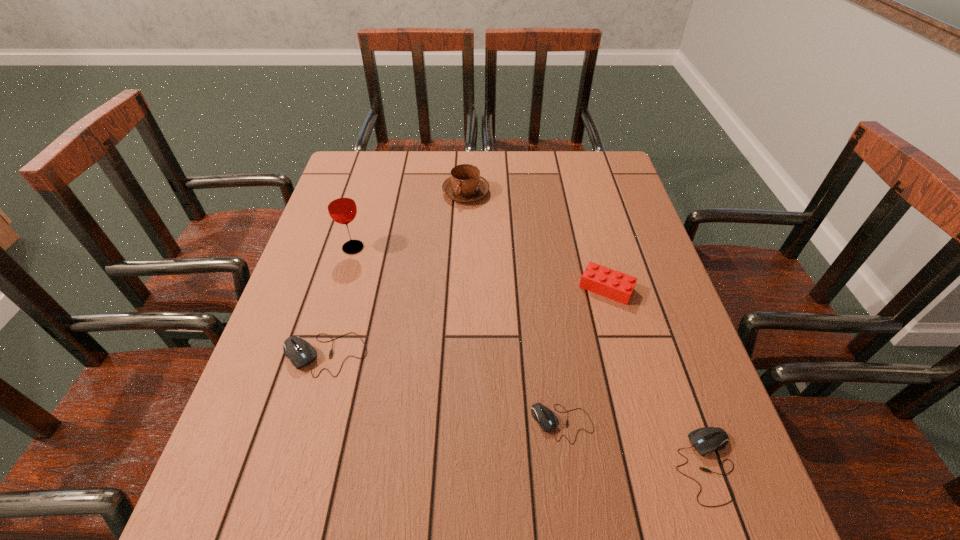
Locate which object is the fifth closest to the second shortest computer mouse. Please provide its 2D coordinates. Your answer should be formatted as a tuple, i.e. [(x, y)], where the tuple contains the x and y coordinates of a point satisfying the conditions above.

[(341, 205)]

The image size is (960, 540). Find the location of `the second closest computer mouse to the shortest computer mouse`. the second closest computer mouse to the shortest computer mouse is located at coordinates (300, 352).

What are the coordinates of `the closest computer mouse to the fifth nearest object` in the screenshot? It's located at (300, 352).

Locate an element on the screen. vacant space that satisfies the following two spatial constraints: 1. on the side of the cappuccino with the handle; 2. on the left side of the Lego is located at coordinates (462, 288).

At what (x,y) coordinates should I click in order to perform the action: click on vacant space that satisfies the following two spatial constraints: 1. on the side of the fifth tallest object with the handle; 2. on the right side of the cappuccino. Please return your answer as a coordinate pair (x, y). The width and height of the screenshot is (960, 540). Looking at the image, I should click on (455, 465).